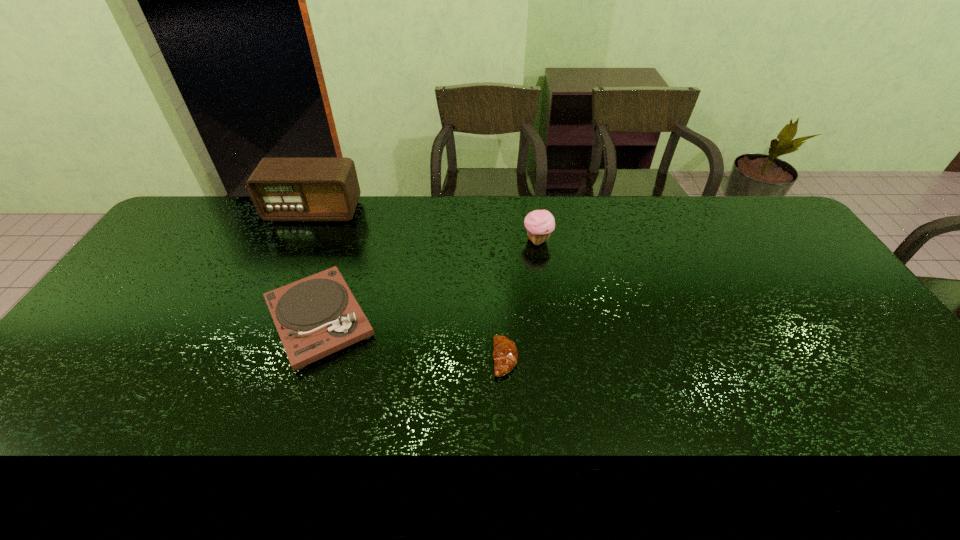
Locate an element on the screen. The width and height of the screenshot is (960, 540). vacant region located 0.050m on the right of the shortest object is located at coordinates (537, 359).

At what (x,y) coordinates should I click in order to perform the action: click on radio receiver that is positioned at the far edge. Please return your answer as a coordinate pair (x, y). Looking at the image, I should click on (282, 189).

This screenshot has height=540, width=960. I want to click on cupcake located at the far edge, so click(x=540, y=223).

Where is `vacant area at the far edge`? Image resolution: width=960 pixels, height=540 pixels. vacant area at the far edge is located at coordinates (393, 208).

This screenshot has height=540, width=960. In order to click on free spot at the near edge of the desktop in this screenshot , I will do `click(605, 455)`.

Identify the location of vacant region at the left edge of the desktop. (139, 320).

Locate an element on the screen. The height and width of the screenshot is (540, 960). vacant area at the right edge is located at coordinates (835, 332).

At what (x,y) coordinates should I click in order to perform the action: click on vacant area at the far left corner of the desktop. Please return your answer as a coordinate pair (x, y). The width and height of the screenshot is (960, 540). Looking at the image, I should click on point(220,199).

You are a GUI agent. You are given a task and a screenshot of the screen. Output one action in this format:
    pyautogui.click(x=<x>, y=<y>)
    Task: Click on the free spot between the farthest object and the cupcake
    
    Given the screenshot: What is the action you would take?
    pyautogui.click(x=425, y=226)

Find the location of a particular element. Image resolution: width=960 pixels, height=540 pixels. free space between the phonograph_record and the crescent roll is located at coordinates (412, 339).